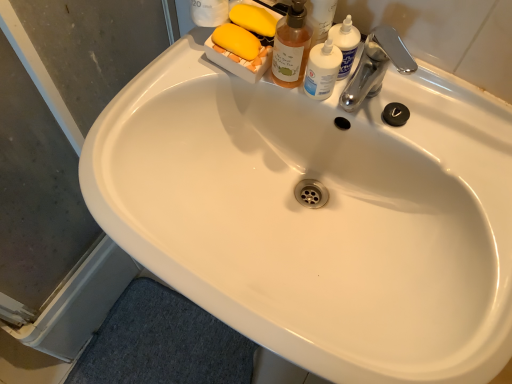
This screenshot has width=512, height=384. I want to click on silver metallic faucet at upper right, so click(x=376, y=66).

This screenshot has height=384, width=512. Find the location of `transparent glass screen door at lower left`. transparent glass screen door at lower left is located at coordinates (60, 170).

From the image's perspective, is translucent plastic bottle at upper right below transparent glass screen door at lower left?

Incorrect, from the image's perspective, translucent plastic bottle at upper right is higher than transparent glass screen door at lower left.

Looking at this image, is translucent plastic bottle at upper right taller or shorter than transparent glass screen door at lower left?

translucent plastic bottle at upper right is shorter than transparent glass screen door at lower left.

Is translucent plastic bottle at upper right bigger than transparent glass screen door at lower left?

No, translucent plastic bottle at upper right is not bigger than transparent glass screen door at lower left.

Is transparent glass screen door at lower left spatially inside silver metallic faucet at upper right, or outside of it?

The correct answer is: outside.

Does transparent glass screen door at lower left have a greater width compared to silver metallic faucet at upper right?

No, transparent glass screen door at lower left is not wider than silver metallic faucet at upper right.

Is transparent glass screen door at lower left far from silver metallic faucet at upper right?

No, there isn't a large distance between transparent glass screen door at lower left and silver metallic faucet at upper right.

Is transparent glass screen door at lower left closer to camera compared to silver metallic faucet at upper right?

Yes, transparent glass screen door at lower left is closer to the camera.

In the scene shown: Can translucent amber bottle at upper right be found inside silver metallic faucet at upper right?

No, silver metallic faucet at upper right does not contain translucent amber bottle at upper right.

From a real-world perspective, relative to translucent amber bottle at upper right, is silver metallic faucet at upper right vertically above or below?

silver metallic faucet at upper right is situated lower than translucent amber bottle at upper right in the real world.

Does silver metallic faucet at upper right appear on the left side of translucent amber bottle at upper right?

In fact, silver metallic faucet at upper right is to the right of translucent amber bottle at upper right.

Where is `cleaning product positioned vertically above the silver metallic faucet at upper right (from a real-world perspective)`? cleaning product positioned vertically above the silver metallic faucet at upper right (from a real-world perspective) is located at coordinates (291, 46).

How far apart are translucent amber bottle at upper right and silver metallic faucet at upper right?

translucent amber bottle at upper right is 4.58 inches from silver metallic faucet at upper right.

From the image's perspective, who appears lower, translucent amber bottle at upper right or silver metallic faucet at upper right?

From the image's view, silver metallic faucet at upper right is below.

How different are the orientations of translucent amber bottle at upper right and silver metallic faucet at upper right in degrees?

translucent amber bottle at upper right and silver metallic faucet at upper right are facing 0.000179 degrees away from each other.

Can you confirm if translucent amber bottle at upper right is wider than silver metallic faucet at upper right?

No, translucent amber bottle at upper right is not wider than silver metallic faucet at upper right.

Between silver metallic faucet at upper right and transparent glass screen door at lower left, which one has smaller size?

Smaller between the two is silver metallic faucet at upper right.

Is silver metallic faucet at upper right inside or outside of transparent glass screen door at lower left?

silver metallic faucet at upper right is located beyond the bounds of transparent glass screen door at lower left.

Between silver metallic faucet at upper right and transparent glass screen door at lower left, which one appears on the left side from the viewer's perspective?

transparent glass screen door at lower left is more to the left.

Are silver metallic faucet at upper right and transparent glass screen door at lower left located far from each other?

They are positioned close to each other.

Is translucent amber bottle at upper right at the right side of translucent plastic bottle at upper right?

No, translucent amber bottle at upper right is not to the right of translucent plastic bottle at upper right.

Is translucent amber bottle at upper right smaller than translucent plastic bottle at upper right?

No, translucent amber bottle at upper right is not smaller than translucent plastic bottle at upper right.

Who is shorter, translucent amber bottle at upper right or translucent plastic bottle at upper right?

translucent plastic bottle at upper right is shorter.

From a real-world perspective, relative to translucent amber bottle at upper right, is transparent glass screen door at lower left vertically above or below?

In terms of real-world spatial position, transparent glass screen door at lower left is below translucent amber bottle at upper right.

Is transparent glass screen door at lower left turned away from translucent amber bottle at upper right?

No, transparent glass screen door at lower left is not facing the opposite direction of translucent amber bottle at upper right.

From the image's perspective, relative to translucent amber bottle at upper right, is transparent glass screen door at lower left above or below?

transparent glass screen door at lower left is situated lower than translucent amber bottle at upper right in the image.

From the picture: How distant is transparent glass screen door at lower left from translucent amber bottle at upper right?

transparent glass screen door at lower left and translucent amber bottle at upper right are 51.51 centimeters apart from each other.

Identify the location of screen door that is under the translucent plastic bottle at upper right (from a real-world perspective). The height and width of the screenshot is (384, 512). (60, 170).

Where is `tap behind the transparent glass screen door at lower left`? tap behind the transparent glass screen door at lower left is located at coordinates click(376, 66).

When comparing their distances from translucent plastic bottle at upper right, does silver metallic faucet at upper right or transparent glass screen door at lower left seem further?

transparent glass screen door at lower left.

Estimate the real-world distances between objects in this image. Which object is further from translucent plastic bottle at upper right, transparent glass screen door at lower left or silver metallic faucet at upper right?

Based on the image, transparent glass screen door at lower left appears to be further to translucent plastic bottle at upper right.

Based on their spatial positions, is translucent plastic bottle at upper right or transparent glass screen door at lower left closer to translucent amber bottle at upper right?

Based on the image, translucent plastic bottle at upper right appears to be nearer to translucent amber bottle at upper right.

From the image, which object appears to be farther from transparent glass screen door at lower left, silver metallic faucet at upper right or translucent plastic bottle at upper right?

Among the two, silver metallic faucet at upper right is located further to transparent glass screen door at lower left.

From the picture: Based on their spatial positions, is translucent amber bottle at upper right or translucent plastic bottle at upper right closer to silver metallic faucet at upper right?

The object closer to silver metallic faucet at upper right is translucent plastic bottle at upper right.

From the image, which object appears to be nearer to translucent amber bottle at upper right, translucent plastic bottle at upper right or silver metallic faucet at upper right?

translucent plastic bottle at upper right is closer to translucent amber bottle at upper right.

Considering their positions, is translucent amber bottle at upper right positioned closer to transparent glass screen door at lower left than silver metallic faucet at upper right?

Among the two, translucent amber bottle at upper right is located nearer to transparent glass screen door at lower left.

When comparing their distances from translucent amber bottle at upper right, does silver metallic faucet at upper right or transparent glass screen door at lower left seem closer?

silver metallic faucet at upper right lies closer to translucent amber bottle at upper right than the other object.

The height and width of the screenshot is (384, 512). What are the coordinates of `toiletry between translucent amber bottle at upper right and silver metallic faucet at upper right` in the screenshot? It's located at (322, 70).

Locate an element on the screen. The image size is (512, 384). cleaning product located between transparent glass screen door at lower left and silver metallic faucet at upper right in the left-right direction is located at coordinates click(x=291, y=46).

The image size is (512, 384). What are the coordinates of `cleaning product between transparent glass screen door at lower left and translucent plastic bottle at upper right from left to right` in the screenshot? It's located at (291, 46).

Find the location of a particular element. toiletry between transparent glass screen door at lower left and silver metallic faucet at upper right from left to right is located at coordinates (322, 70).